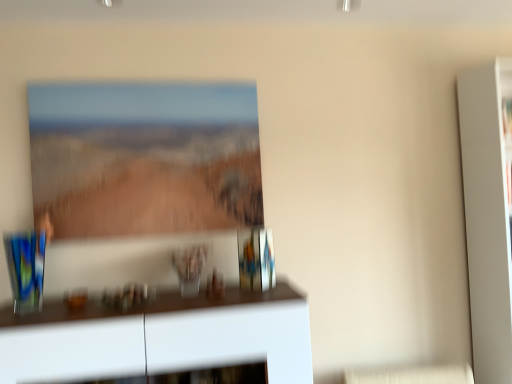
Question: Is white glossy cabinet at lower center at the right side of translucent glass vase at center?

Choices:
 (A) no
 (B) yes

Answer: (A)

Question: Does white glossy cabinet at lower center have a larger size compared to translucent glass vase at center?

Choices:
 (A) no
 (B) yes

Answer: (B)

Question: Is white glossy cabinet at lower center behind translucent glass vase at center?

Choices:
 (A) no
 (B) yes

Answer: (A)

Question: Does white glossy cabinet at lower center contain translucent glass vase at center?

Choices:
 (A) no
 (B) yes

Answer: (A)

Question: From a real-world perspective, is white glossy cabinet at lower center under translucent glass vase at center?

Choices:
 (A) yes
 (B) no

Answer: (A)

Question: Is white glossy cabinet at lower center inside the boundaries of translucent glass vase at center, or outside?

Choices:
 (A) outside
 (B) inside

Answer: (A)

Question: From a real-world perspective, is white glossy cabinet at lower center positioned above or below translucent glass vase at center?

Choices:
 (A) below
 (B) above

Answer: (A)

Question: From their relative heights in the image, would you say white glossy cabinet at lower center is taller or shorter than translucent glass vase at center?

Choices:
 (A) short
 (B) tall

Answer: (B)

Question: Considering the positions of white glossy cabinet at lower center and translucent glass vase at center in the image, is white glossy cabinet at lower center bigger or smaller than translucent glass vase at center?

Choices:
 (A) big
 (B) small

Answer: (A)

Question: Considering the positions of point (156, 105) and point (199, 278), is point (156, 105) closer or farther from the camera than point (199, 278)?

Choices:
 (A) farther
 (B) closer

Answer: (A)

Question: From the image's perspective, is matte glass picture frame at upper center above or below translucent glass vase at center?

Choices:
 (A) below
 (B) above

Answer: (B)

Question: Considering the positions of matte glass picture frame at upper center and translucent glass vase at center in the image, is matte glass picture frame at upper center taller or shorter than translucent glass vase at center?

Choices:
 (A) short
 (B) tall

Answer: (B)

Question: From a real-world perspective, is matte glass picture frame at upper center physically located above or below translucent glass vase at center?

Choices:
 (A) below
 (B) above

Answer: (B)

Question: Based on their positions, is translucent glass vase at center located to the left or right of matte glass picture frame at upper center?

Choices:
 (A) right
 (B) left

Answer: (A)

Question: Considering the positions of point (199, 261) and point (256, 200), is point (199, 261) closer or farther from the camera than point (256, 200)?

Choices:
 (A) closer
 (B) farther

Answer: (A)